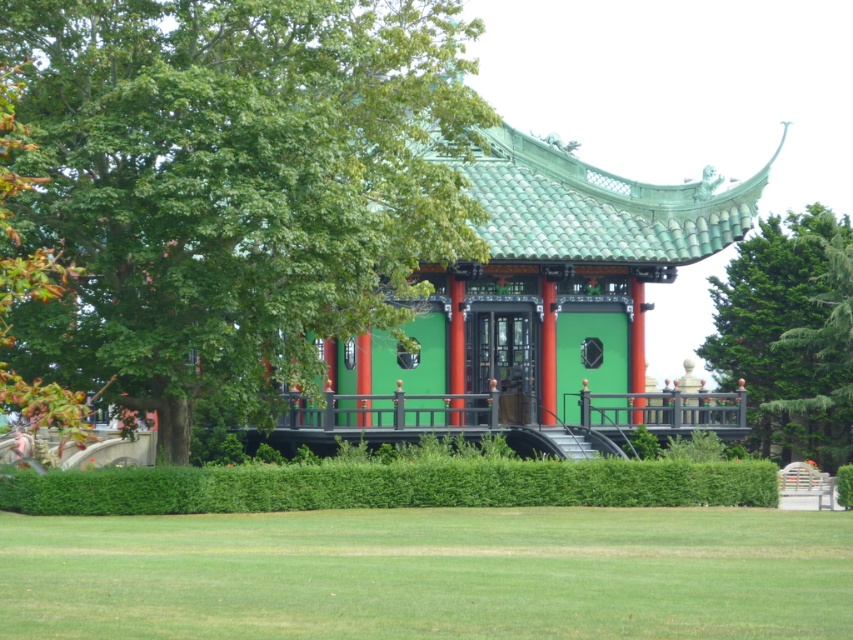
Question: Can you confirm if green leafy tree at upper left is wider than green matte pavilion at center?

Choices:
 (A) yes
 (B) no

Answer: (B)

Question: Which point is closer to the camera?

Choices:
 (A) green leafy tree at upper left
 (B) green leafy hedge at lower center

Answer: (A)

Question: Which is nearer to the green textured tree at upper right?

Choices:
 (A) green leafy tree at upper left
 (B) green leafy hedge at lower center
 (C) green matte pavilion at center

Answer: (C)

Question: Is green leafy tree at upper left to the right of green textured tree at upper right from the viewer's perspective?

Choices:
 (A) no
 (B) yes

Answer: (A)

Question: Which object appears farthest from the camera in this image?

Choices:
 (A) green leafy tree at upper left
 (B) green textured tree at upper right

Answer: (B)

Question: Is green grass at lower center bigger than green leafy hedge at lower center?

Choices:
 (A) no
 (B) yes

Answer: (B)